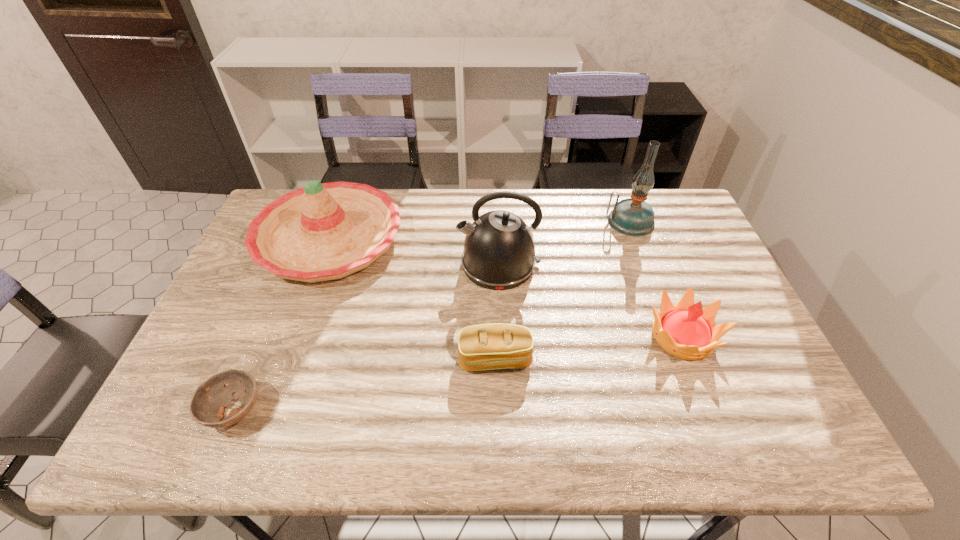
This screenshot has height=540, width=960. Identify the location of vacant space located on the spout of the kettle. coord(382,265).

The image size is (960, 540). Identify the location of blank space located 0.380m on the front of the sombrero. (265, 417).

This screenshot has height=540, width=960. In order to click on free space located on the left of the crown in this screenshot , I will do `click(504, 336)`.

Locate an element on the screen. The image size is (960, 540). free region located on the zipper side of the clutch bag is located at coordinates (498, 450).

This screenshot has height=540, width=960. I want to click on free space located 0.060m on the right of the nearest object, so click(290, 410).

The image size is (960, 540). What are the coordinates of `oil lamp at the far edge` in the screenshot? It's located at (634, 217).

Identify the location of sombrero that is at the far edge. (325, 231).

Identify the location of object present at the near edge. [x=207, y=406].

I want to click on sombrero located at the left edge, so click(x=325, y=231).

You are a GUI agent. You are given a task and a screenshot of the screen. Output one action in this format:
    pyautogui.click(x=<x>, y=<y>)
    Task: Click on the bowl present at the left edge
    The height and width of the screenshot is (540, 960).
    Given the screenshot: What is the action you would take?
    pos(207,406)